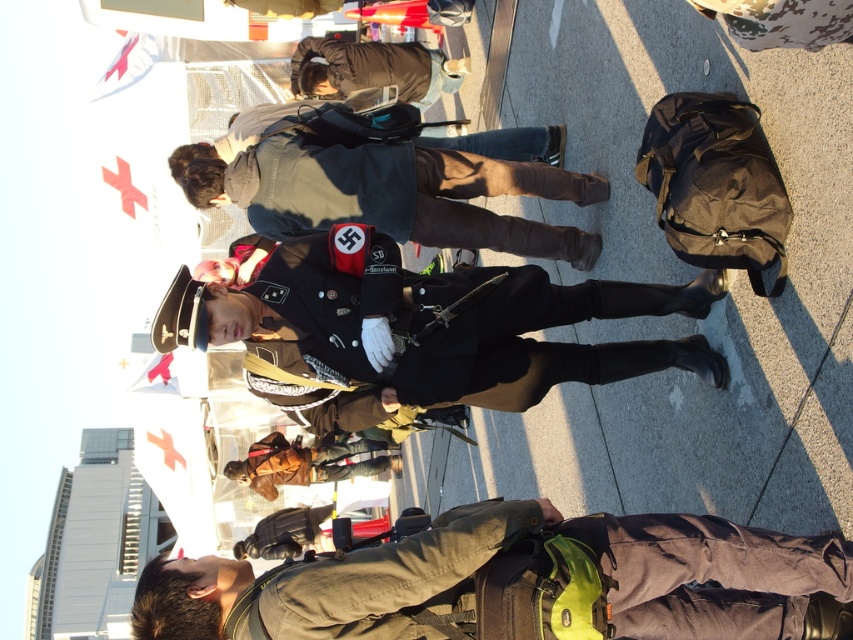
You are a photographer at the cosplay event. You need to capture a photo of both the dark brown leather jacket at upper center and the brown leather jacket at center in the same frame. Which jacket should you focus on to ensure both are visible without cropping?

You should focus on the dark brown leather jacket at upper center because it is shorter than the brown leather jacket at center, allowing both to fit within the frame when positioned appropriately.

You are a photographer at the event and need to capture a clear photo of the shiny black uniform at center without the brown fabric backpack at lower center appearing in the frame. Is this possible?

The brown fabric backpack at lower center is located below the shiny black uniform at center, so adjusting the camera angle upwards to focus on the upper part of the uniform should exclude the backpack from the frame.